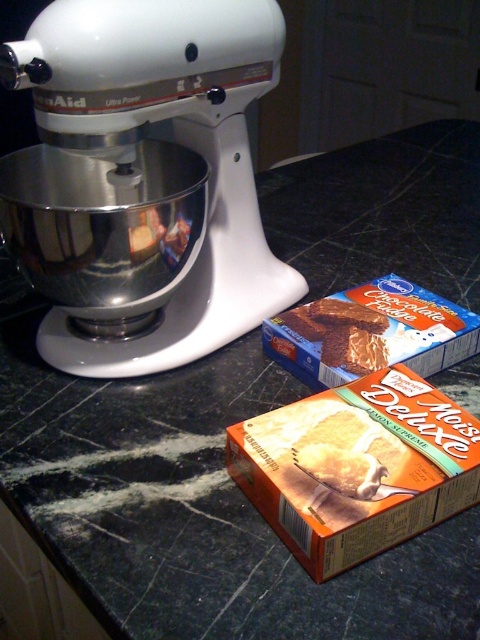
You are a chef preparing to bake a cake and need to reach for the orange cardboard cake mix box at lower right. Is it possible to grab it without moving the white glossy stand mixer at left?

The orange cardboard cake mix box at lower right is behind the white glossy stand mixer at left, so you cannot reach it without moving the mixer first.

You are trying to place a new spice jar between the white glossy stand mixer at left and the orange cardboard cake mix box at lower right on the kitchen counter. Based on their widths, will there be enough space for the spice jar if it is 10 centimeters wide?

The white glossy stand mixer at left might be wider than the orange cardboard cake mix box at lower right, so there may not be enough space for the 10 centimeter wide spice jar between them. Check their actual widths before placing the jar.

In the scene shown: You are a delivery person who just arrived at the kitchen. You need to place a new cake mix box between the two existing points on the countertop. The first point is point [199,51] and the second point is point [430,420]. Which point should you choose to place the new box closer to the camera?

You should place the new cake mix box at point [199,51] because it is further to the camera than point [430,420].